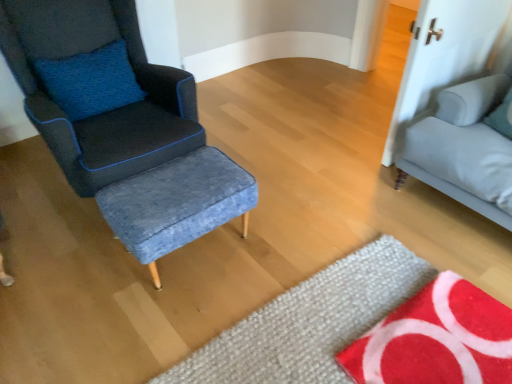
What are the coordinates of `free area in between matte blue fabric chair at left and denim fabric stool at center` in the screenshot? It's located at (126, 281).